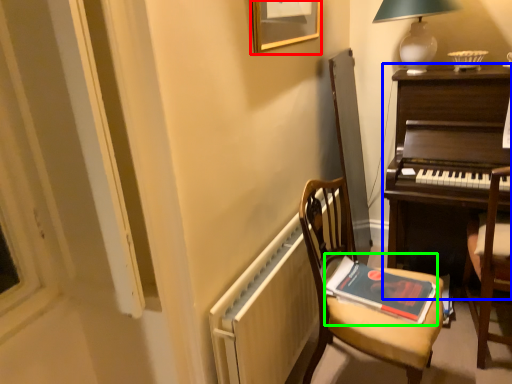
Question: Which is farther away from picture frame (highlighted by a red box)? desk (highlighted by a blue box) or paperback book (highlighted by a green box)?

Choices:
 (A) desk
 (B) paperback book

Answer: (B)